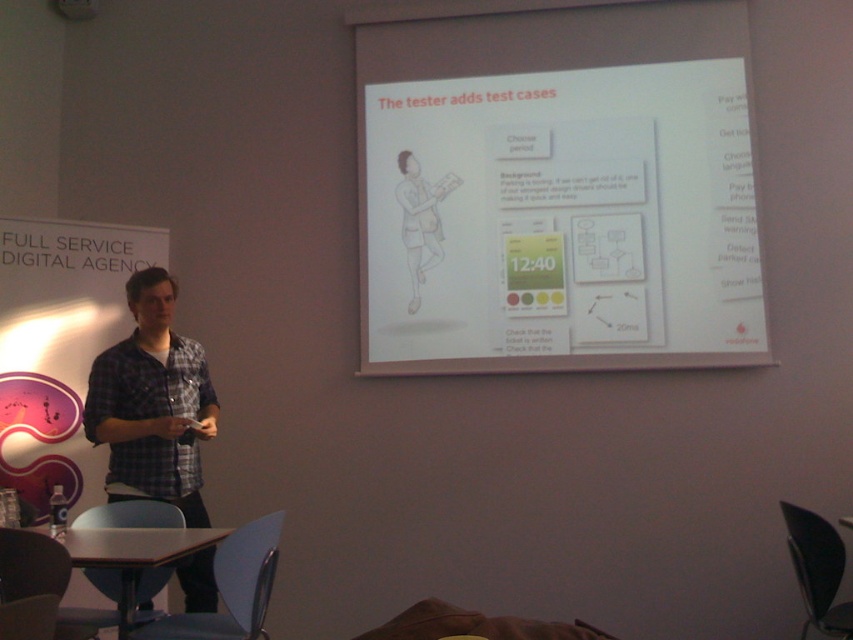
Is white paper at upper center shorter than matte white projector at upper center?

In fact, white paper at upper center may be taller than matte white projector at upper center.

Does point (762, 310) come behind point (76, 17)?

No, it is not.

Is point (457, 312) less distant than point (74, 19)?

Yes.

Where is `white paper at upper center`? The width and height of the screenshot is (853, 640). white paper at upper center is located at coordinates click(x=561, y=220).

Locate an element on the screen. The width and height of the screenshot is (853, 640). white paper at upper center is located at coordinates (561, 220).

Is white paper at upper center in front of plaid cotton shirt at left?

No, white paper at upper center is further to the viewer.

Does point (363, 170) come farther from viewer compared to point (155, 332)?

Yes, it is.

In order to click on white paper at upper center in this screenshot , I will do `click(561, 220)`.

Which is in front, point (171, 464) or point (76, 3)?

Positioned in front is point (171, 464).

The height and width of the screenshot is (640, 853). I want to click on plaid cotton shirt at left, so click(152, 403).